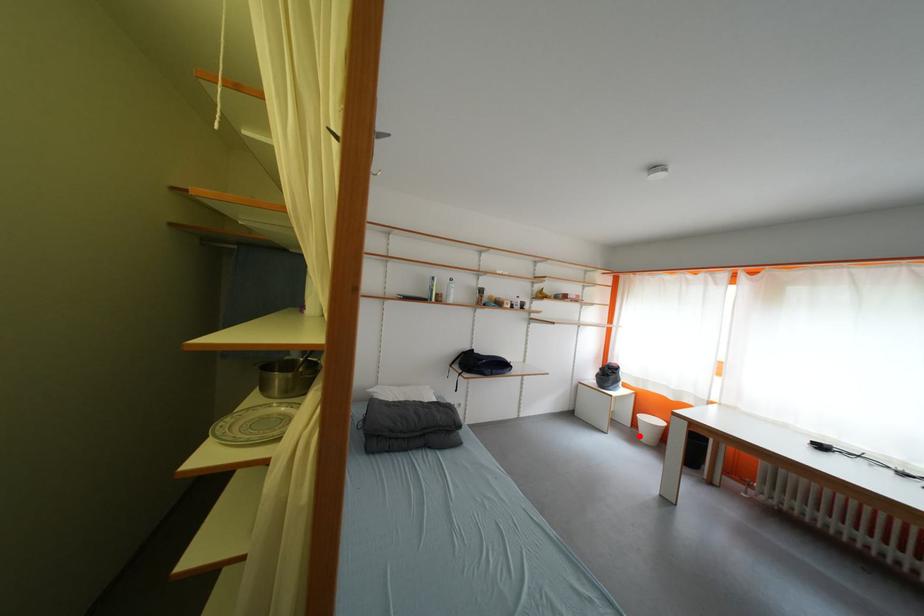
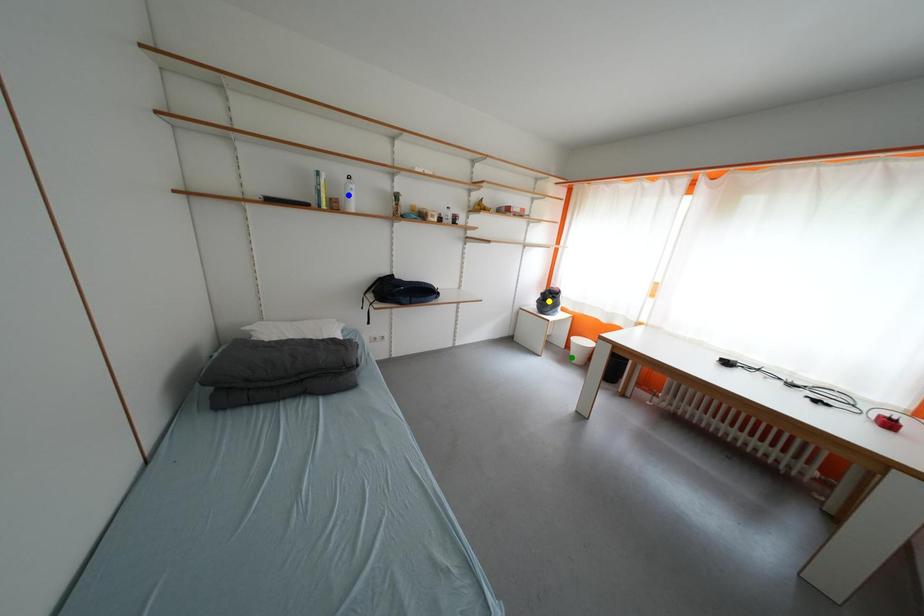
Question: I am providing you with two images of the same scene from different viewpoints. A red point is marked on the first image. You are given multiple points on the second image. Which point in image 2 represents the same 3d spot as the red point in image 1?

Choices:
 (A) green point
 (B) yellow point
 (C) blue point

Answer: (A)